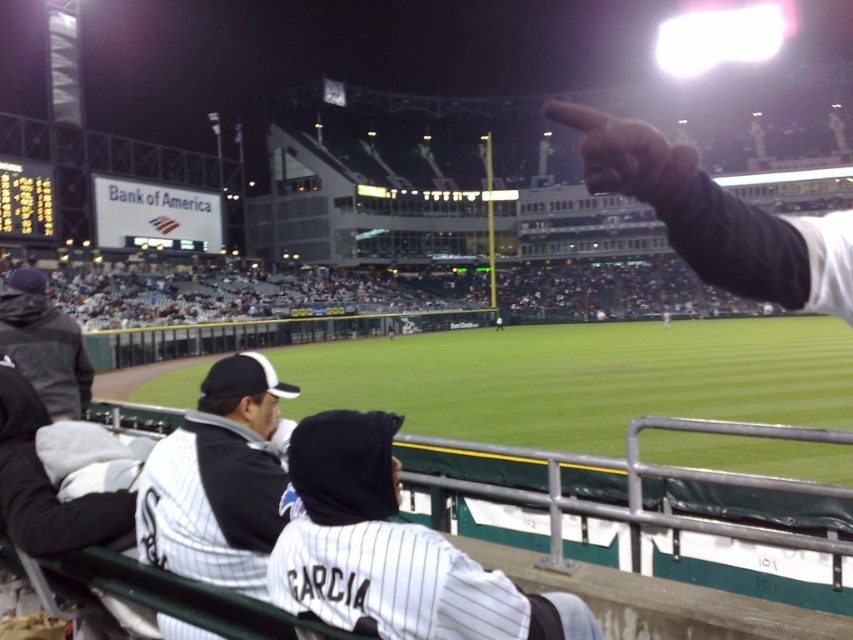
Can you confirm if white pinstriped jersey at lower left is positioned to the left of matte black finger at upper right?

Correct, you'll find white pinstriped jersey at lower left to the left of matte black finger at upper right.

You are a GUI agent. You are given a task and a screenshot of the screen. Output one action in this format:
    pyautogui.click(x=<x>, y=<y>)
    Task: Click on the white pinstriped jersey at lower left
    The height and width of the screenshot is (640, 853).
    Given the screenshot: What is the action you would take?
    pyautogui.click(x=219, y=481)

Between point (503, 634) and point (74, 333), which one is positioned in front?

Point (503, 634) is in front.

Can you confirm if white pinstriped jersey at center is positioned to the left of dark gray hoodie at left?

No, white pinstriped jersey at center is not to the left of dark gray hoodie at left.

Where is `white pinstriped jersey at center`? white pinstriped jersey at center is located at coordinates (392, 550).

Identify the location of white pinstriped jersey at center. (392, 550).

Does matte black finger at upper right appear under dark gray hoodie at left?

Yes.

Does matte black finger at upper right have a larger size compared to dark gray hoodie at left?

Incorrect, matte black finger at upper right is not larger than dark gray hoodie at left.

Who is more distant from viewer, (740, 243) or (68, 392)?

Positioned behind is point (68, 392).

The image size is (853, 640). I want to click on matte black finger at upper right, so click(694, 209).